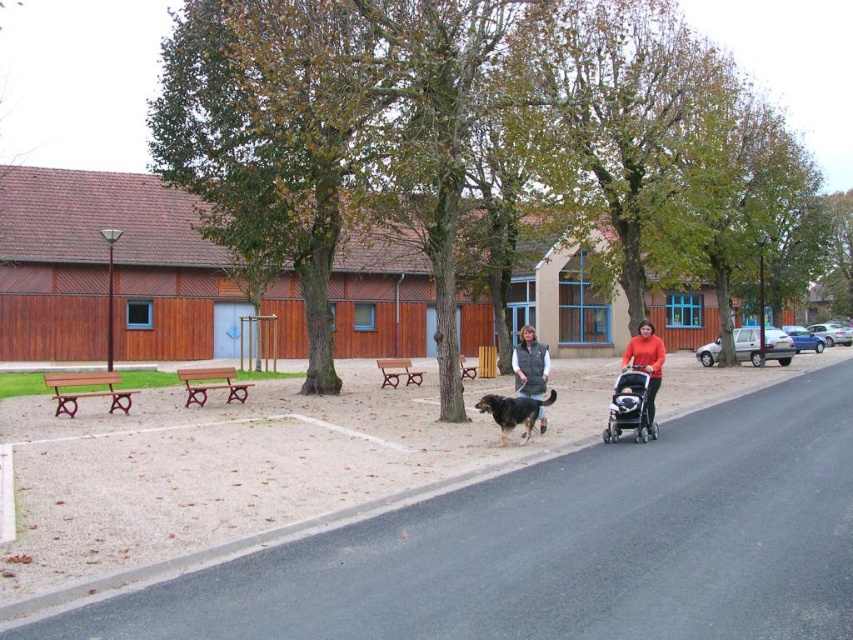
Question: Considering the relative positions of green leafy tree at center and brown fur dog at lower center in the image provided, where is green leafy tree at center located with respect to brown fur dog at lower center?

Choices:
 (A) below
 (B) above

Answer: (B)

Question: Which point appears farthest from the camera in this image?

Choices:
 (A) (642, 346)
 (B) (511, 397)
 (C) (631, 376)
 (D) (532, 392)

Answer: (A)

Question: Based on their relative distances, which object is farther from the green leafy tree at center?

Choices:
 (A) brown fur dog at lower center
 (B) matte orange sweater at center

Answer: (A)

Question: Among these objects, which one is farthest from the camera?

Choices:
 (A) matte orange sweater at center
 (B) silver metallic stroller at right
 (C) brown fur dog at lower center

Answer: (A)

Question: Considering the relative positions of green leafy tree at center and silver metallic stroller at right in the image provided, where is green leafy tree at center located with respect to silver metallic stroller at right?

Choices:
 (A) above
 (B) below

Answer: (A)

Question: Is dark gray fleece vest at center thinner than brown fur dog at lower center?

Choices:
 (A) yes
 (B) no

Answer: (B)